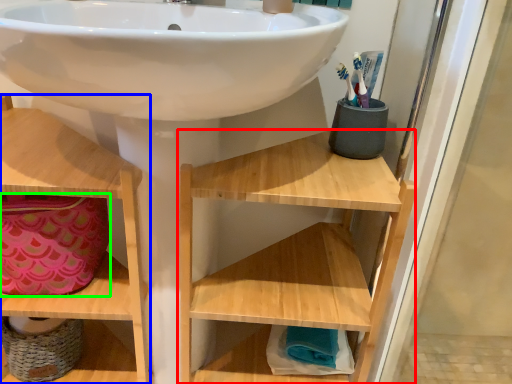
Question: Which is farther away from shelf (highlighted by a red box)? shelf (highlighted by a blue box) or material (highlighted by a green box)?

Choices:
 (A) shelf
 (B) material

Answer: (B)